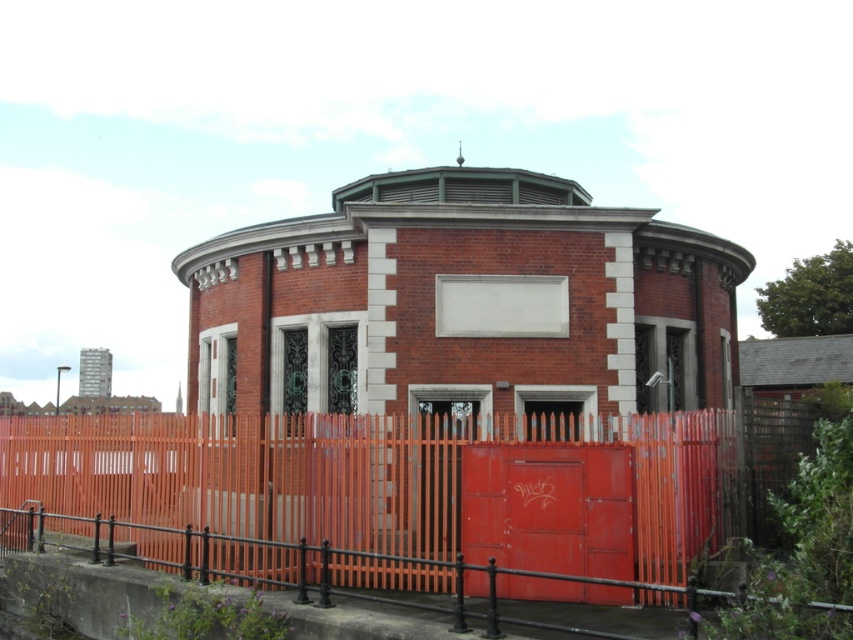
You are standing at the entrance of the round brick building and want to find the orange wooden fence at lower left. According to the coordinates provided, where should you look relative to the building?

The orange wooden fence at lower left is located at coordinates point (354, 476), which means it is positioned to the lower left side of the building.

You are a painter who needs to paint both the orange wooden fence at lower left and the metallic red door at center. Given that the fence requires more paint due to its size, which object should you tackle first if you want to use the least amount of paint first?

The metallic red door at center requires less paint because it is smaller than the orange wooden fence at lower left, so you should paint the metallic red door at center first.